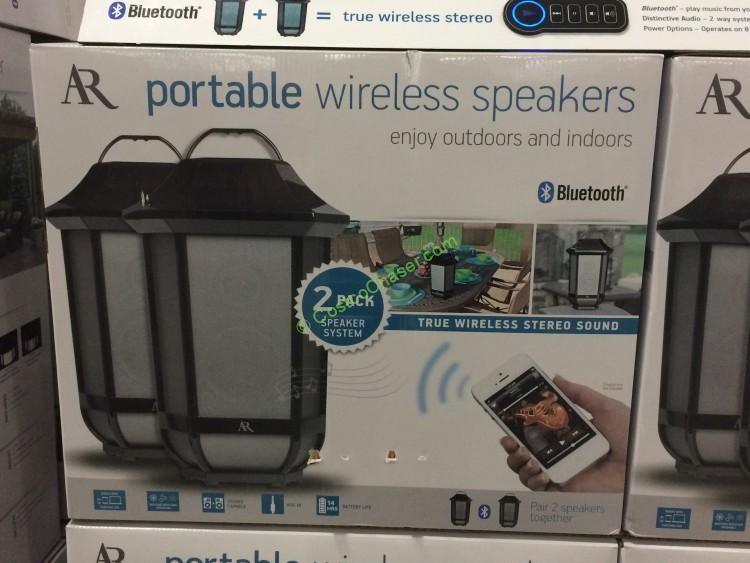
Where is `remote control`? remote control is located at coordinates coord(573,17).